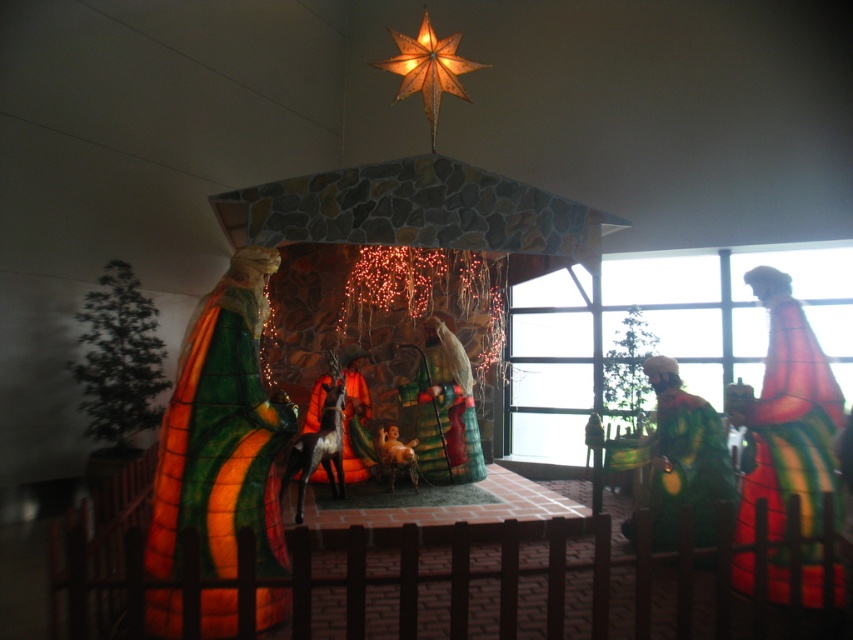
You are an event planner setting up a nativity scene. You want to place a small decoration between the transparent glass window at right and the green textured robe at right. Is there enough space for the decoration?

The transparent glass window at right and the green textured robe at right are 3.30 meters apart, so there is sufficient space to place a small decoration between them.

You are standing in front of the nativity scene and want to see the transparent glass window at right without moving your feet. Can you see it in your current position?

The transparent glass window at right is 6.41 meters from viewer, so yes, you can see it from your current position as it is within sight distance.

You are an observer standing in front of the nativity scene. You notice both the transparent glass window at right and the green textured robe at right. Which object is taller?

The transparent glass window at right is taller than the green textured robe at right.